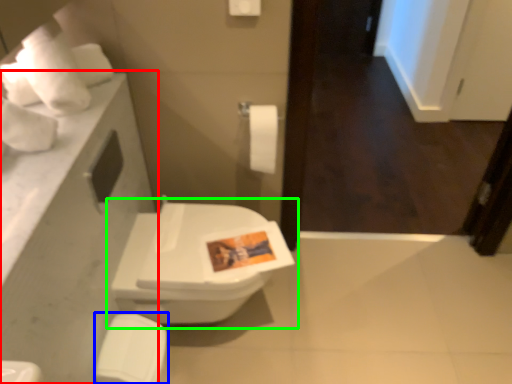
Question: Which object is positioned closest to counter top (highlighted by a red box)? Select from porcelain (highlighted by a blue box) and toilet (highlighted by a green box).

Choices:
 (A) porcelain
 (B) toilet

Answer: (B)